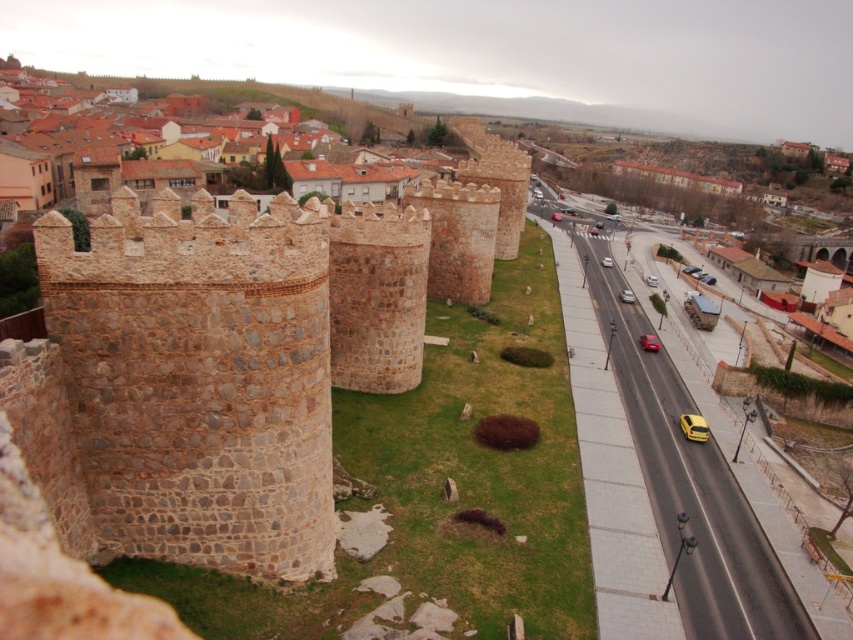
Based on the photo, you are a tourist visiting the ancient city and want to take a photo of both the brown stone castle at center and the silver metallic car at center. Since you have a wide angle lens, will you be able to fit both objects in the frame?

The brown stone castle at center is bigger than the silver metallic car at center. Since the castle is larger, it might occupy more space in the frame, but with a wide angle lens, you should still be able to fit both objects in the photo as they are both positioned at the center of the scene.

You are a tour guide leading a group along the ancient stone wall pathway. You notice a shiny red car at center parked on the road. The road is 3 meters wide. If the car is parked at the edge closest to the pathway, how much distance would a tourist need to walk to safely cross from the pathway to the road without getting too close to the car?

The shiny red car at center is parked 59.36 meters away from the pathway. Since the road is 3 meters wide and the car is at the edge closest to the pathway, the tourist needs to walk 3 meters to reach the road, but must stay 59.36 meters away from the car. However, this distance seems excessively large for a typical road scenario, suggesting a possible error in the provided measurement.